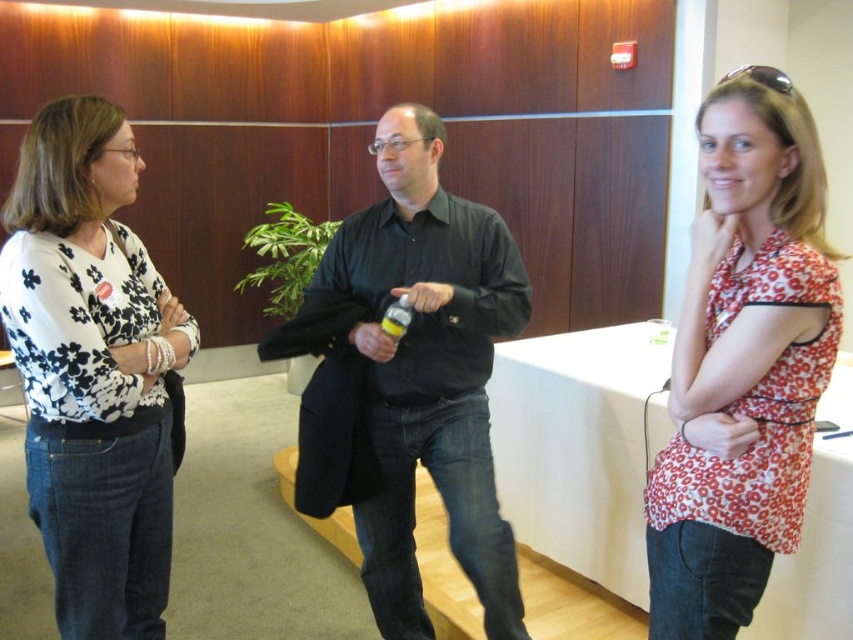
How distant is black matte shirt at center from yellow matte bottle at center?

black matte shirt at center is 12.50 inches away from yellow matte bottle at center.

Which is above, black matte shirt at center or yellow matte bottle at center?

yellow matte bottle at center is higher up.

You are a GUI agent. You are given a task and a screenshot of the screen. Output one action in this format:
    pyautogui.click(x=<x>, y=<y>)
    Task: Click on the black matte shirt at center
    The image size is (853, 640).
    Given the screenshot: What is the action you would take?
    pyautogui.click(x=409, y=378)

Between floral fabric blouse at right and yellow matte bottle at center, which one is positioned lower?

floral fabric blouse at right

Is point (758, 157) positioned in front of point (409, 323)?

Yes, point (758, 157) is closer to viewer.

Locate an element on the screen. The width and height of the screenshot is (853, 640). floral fabric blouse at right is located at coordinates (743, 362).

Does point (299, 433) come farther from viewer compared to point (97, 524)?

Yes, it is behind point (97, 524).

Which of these two, black matte shirt at center or white floral blouse at left, stands shorter?

Standing shorter between the two is white floral blouse at left.

Which is in front, point (465, 253) or point (67, 241)?

Point (67, 241)

The height and width of the screenshot is (640, 853). Find the location of `black matte shirt at center`. black matte shirt at center is located at coordinates (409, 378).